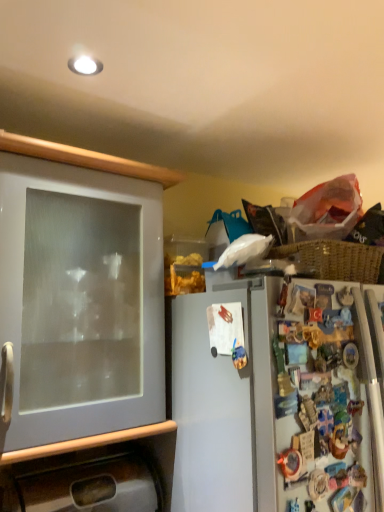
Question: Looking at their shapes, would you say brushed metal sink at lower left, the 2th cabinetry when ordered from top to bottom, is wider or thinner than white glossy cabinet door at left, which is the first cabinetry from top to bottom?

Choices:
 (A) wide
 (B) thin

Answer: (B)

Question: Considering their positions, is brushed metal sink at lower left, the 2th cabinetry when ordered from top to bottom, located in front of or behind white glossy cabinet door at left, marked as the 2th cabinetry in a bottom-to-top arrangement?

Choices:
 (A) behind
 (B) front

Answer: (A)

Question: Is brushed metal sink at lower left, placed as the first cabinetry when sorted from bottom to top, bigger or smaller than white glossy cabinet door at left, which is the first cabinetry from top to bottom?

Choices:
 (A) big
 (B) small

Answer: (B)

Question: Considering the positions of point (81, 267) and point (129, 444), is point (81, 267) closer or farther from the camera than point (129, 444)?

Choices:
 (A) closer
 (B) farther

Answer: (A)

Question: Considering the positions of white glossy cabinet door at left, which is the first cabinetry from top to bottom, and brushed metal sink at lower left, the 2th cabinetry when ordered from top to bottom, in the image, is white glossy cabinet door at left, which is the first cabinetry from top to bottom, taller or shorter than brushed metal sink at lower left, the 2th cabinetry when ordered from top to bottom,?

Choices:
 (A) short
 (B) tall

Answer: (B)

Question: Based on their sizes in the image, would you say white glossy cabinet door at left, which is the first cabinetry from top to bottom, is bigger or smaller than brushed metal sink at lower left, placed as the first cabinetry when sorted from bottom to top?

Choices:
 (A) small
 (B) big

Answer: (B)

Question: Is white glossy cabinet door at left, marked as the 2th cabinetry in a bottom-to-top arrangement, to the left or to the right of brushed metal sink at lower left, the 2th cabinetry when ordered from top to bottom, in the image?

Choices:
 (A) right
 (B) left

Answer: (B)